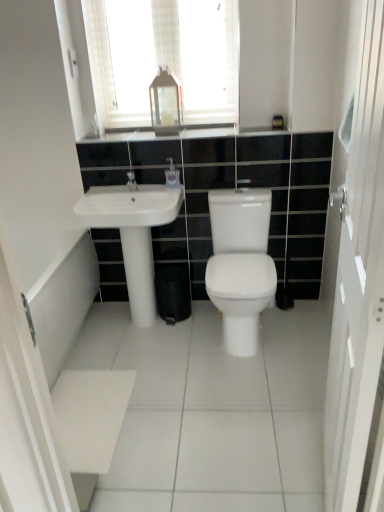
Question: Could you tell me if white glossy soap dispenser at center is facing white textured mirror at upper center?

Choices:
 (A) yes
 (B) no

Answer: (B)

Question: From the image's perspective, is white glossy soap dispenser at center located beneath white textured mirror at upper center?

Choices:
 (A) no
 (B) yes

Answer: (B)

Question: From the image's perspective, is white glossy soap dispenser at center over white textured mirror at upper center?

Choices:
 (A) yes
 (B) no

Answer: (B)

Question: Does white glossy soap dispenser at center have a greater width compared to white textured mirror at upper center?

Choices:
 (A) no
 (B) yes

Answer: (A)

Question: Does white glossy soap dispenser at center come in front of white textured mirror at upper center?

Choices:
 (A) yes
 (B) no

Answer: (B)

Question: Considering the positions of white textured mirror at upper center and matte silver faucet at center in the image, is white textured mirror at upper center taller or shorter than matte silver faucet at center?

Choices:
 (A) tall
 (B) short

Answer: (A)

Question: Is white textured mirror at upper center in front of or behind matte silver faucet at center in the image?

Choices:
 (A) front
 (B) behind

Answer: (B)

Question: From a real-world perspective, is white textured mirror at upper center above or below matte silver faucet at center?

Choices:
 (A) above
 (B) below

Answer: (A)

Question: From the image's perspective, is white textured mirror at upper center positioned above or below matte silver faucet at center?

Choices:
 (A) above
 (B) below

Answer: (A)

Question: In terms of width, does white textured mirror at upper center look wider or thinner when compared to transparent glass lantern at upper center?

Choices:
 (A) wide
 (B) thin

Answer: (B)

Question: Does point (195, 15) appear closer or farther from the camera than point (173, 105)?

Choices:
 (A) farther
 (B) closer

Answer: (B)

Question: In the image, is white textured mirror at upper center positioned in front of or behind transparent glass lantern at upper center?

Choices:
 (A) behind
 (B) front

Answer: (B)

Question: From a real-world perspective, is white textured mirror at upper center physically located above or below transparent glass lantern at upper center?

Choices:
 (A) above
 (B) below

Answer: (A)

Question: Which is correct: transparent glass lantern at upper center is inside white glossy soap dispenser at center, or outside of it?

Choices:
 (A) outside
 (B) inside

Answer: (A)

Question: From a real-world perspective, relative to white glossy soap dispenser at center, is transparent glass lantern at upper center vertically above or below?

Choices:
 (A) below
 (B) above

Answer: (B)